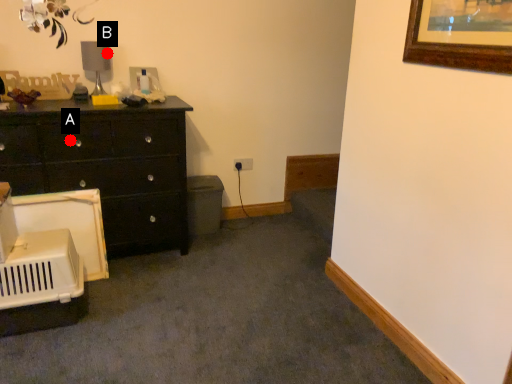
Question: Two points are circled on the image, labeled by A and B beside each circle. Among these points, which one is farthest from the camera?

Choices:
 (A) A is further
 (B) B is further

Answer: (B)